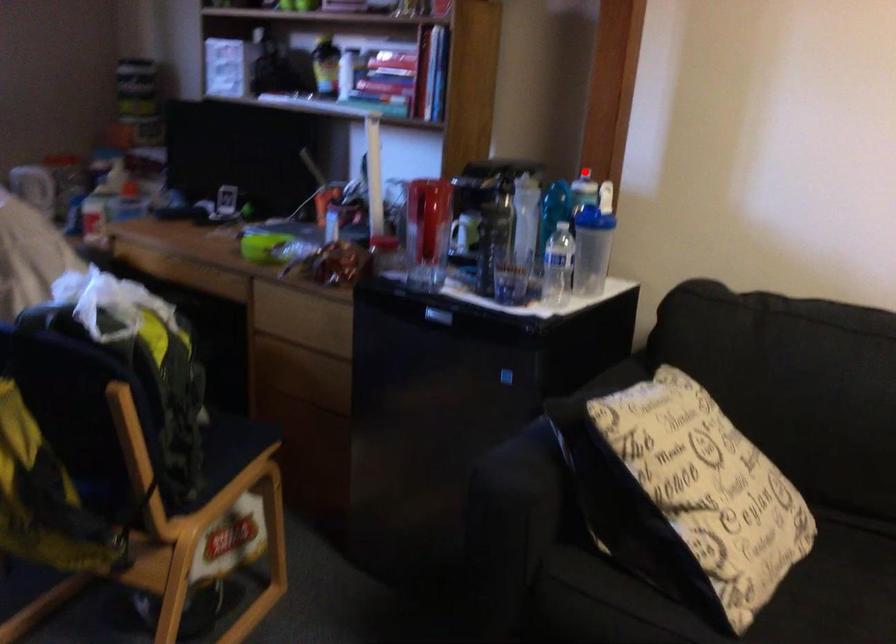
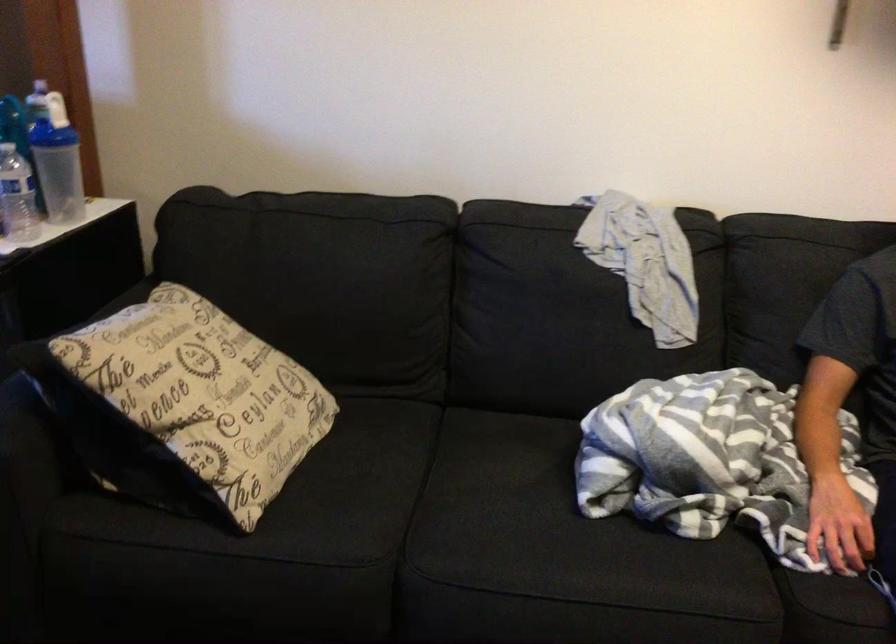
Locate, in the second image, the point that corresponds to the highlighted location in the first image.

(40, 80)